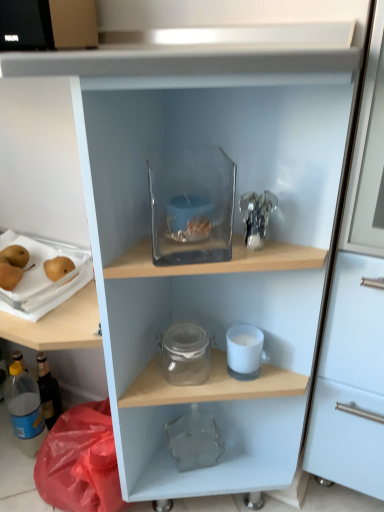
Question: Considering the relative sizes of smooth golden pears at left and translucent plastic bottle at lower left in the image provided, is smooth golden pears at left taller than translucent plastic bottle at lower left?

Choices:
 (A) no
 (B) yes

Answer: (A)

Question: Can you confirm if smooth golden pears at left is smaller than translucent plastic bottle at lower left?

Choices:
 (A) yes
 (B) no

Answer: (A)

Question: Does smooth golden pears at left have a lesser width compared to translucent plastic bottle at lower left?

Choices:
 (A) yes
 (B) no

Answer: (B)

Question: Does smooth golden pears at left have a larger size compared to translucent plastic bottle at lower left?

Choices:
 (A) yes
 (B) no

Answer: (B)

Question: From a real-world perspective, is smooth golden pears at left physically above translucent plastic bottle at lower left?

Choices:
 (A) no
 (B) yes

Answer: (B)

Question: Is white matte candle at lower center, which appears as the 1th appliance when ordered from the bottom, wider or thinner than transparent glass container at upper center, positioned as the second appliance in right-to-left order?

Choices:
 (A) thin
 (B) wide

Answer: (A)

Question: In the image, is white matte candle at lower center, which appears as the 1th appliance when ordered from the bottom, positioned in front of or behind transparent glass container at upper center, the 1th appliance in the top-to-bottom sequence?

Choices:
 (A) front
 (B) behind

Answer: (B)

Question: From their relative heights in the image, would you say white matte candle at lower center, acting as the 3th appliance starting from the top, is taller or shorter than transparent glass container at upper center, the 1th appliance in the top-to-bottom sequence?

Choices:
 (A) short
 (B) tall

Answer: (A)

Question: From the image's perspective, is white matte candle at lower center, which ranks as the 1th appliance in right-to-left order, positioned above or below transparent glass container at upper center, arranged as the 2th appliance when viewed from the left?

Choices:
 (A) below
 (B) above

Answer: (A)

Question: From a real-world perspective, is smooth golden pears at left positioned above or below transparent glass container at upper center, positioned as the second appliance in right-to-left order?

Choices:
 (A) below
 (B) above

Answer: (A)

Question: Is smooth golden pears at left in front of or behind transparent glass container at upper center, positioned as the second appliance in right-to-left order, in the image?

Choices:
 (A) behind
 (B) front

Answer: (A)

Question: Considering the positions of smooth golden pears at left and transparent glass container at upper center, positioned as the second appliance in right-to-left order, in the image, is smooth golden pears at left taller or shorter than transparent glass container at upper center, positioned as the second appliance in right-to-left order,?

Choices:
 (A) short
 (B) tall

Answer: (A)

Question: In terms of size, does smooth golden pears at left appear bigger or smaller than transparent glass container at upper center, arranged as the 2th appliance when viewed from the left?

Choices:
 (A) small
 (B) big

Answer: (A)

Question: From the image's perspective, is translucent plastic tray with pears at left, arranged as the 2th appliance when viewed from the top, located above or below transparent glass container at upper center, the 1th appliance in the top-to-bottom sequence?

Choices:
 (A) above
 (B) below

Answer: (B)

Question: Considering the positions of translucent plastic tray with pears at left, arranged as the second appliance when ordered from the bottom, and transparent glass container at upper center, positioned as the second appliance in right-to-left order, in the image, is translucent plastic tray with pears at left, arranged as the second appliance when ordered from the bottom, wider or thinner than transparent glass container at upper center, positioned as the second appliance in right-to-left order,?

Choices:
 (A) thin
 (B) wide

Answer: (B)